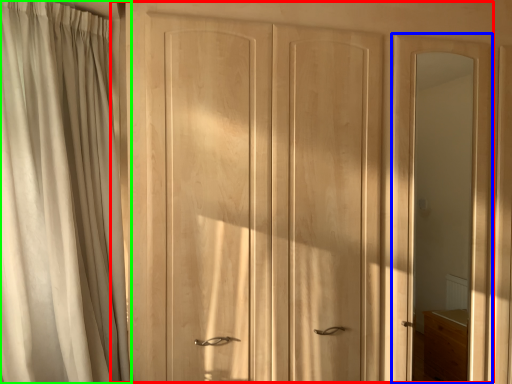
Question: Considering the real-world distances, which object is farthest from door (highlighted by a red box)? screen door (highlighted by a blue box) or curtain (highlighted by a green box)?

Choices:
 (A) screen door
 (B) curtain

Answer: (B)